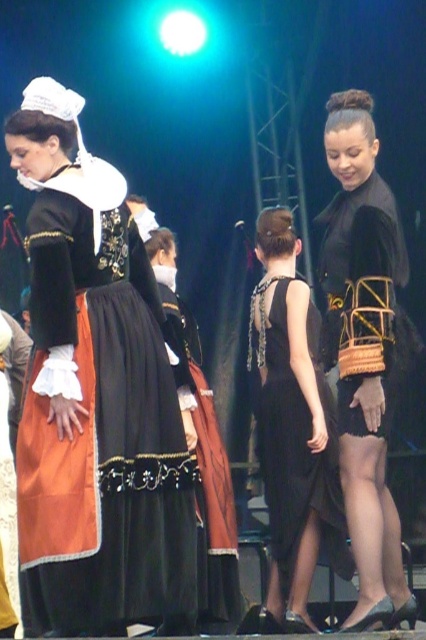
Based on the photo, measure the distance between point (377, 534) and camera.

Point (377, 534) is 6.59 meters away from camera.

Does black matte dress at center have a lesser height compared to black woven basket at center?

In fact, black matte dress at center may be taller than black woven basket at center.

I want to click on black matte dress at center, so click(x=363, y=349).

Which is below, black matte dress at center or matte black dress at center?

matte black dress at center is below.

Identify the location of black matte dress at center. (363, 349).

Identify the location of black matte dress at center. The image size is (426, 640). (363, 349).

Does black satin dress at center appear on the right side of matte black dress at center?

Yes, black satin dress at center is to the right of matte black dress at center.

Describe the element at coordinates (293, 428) in the screenshot. I see `black satin dress at center` at that location.

You are a GUI agent. You are given a task and a screenshot of the screen. Output one action in this format:
    pyautogui.click(x=<x>, y=<y>)
    Task: Click on the black satin dress at center
    This screenshot has height=640, width=426.
    Given the screenshot: What is the action you would take?
    pyautogui.click(x=293, y=428)